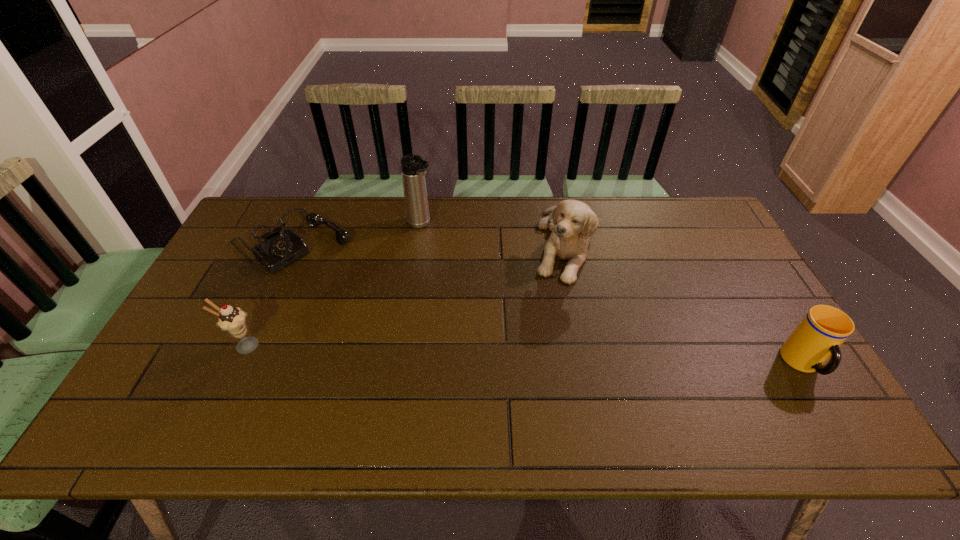
Identify the location of vacant area that lies between the thermos bottle and the icecream. (332, 286).

Identify which object is the second closest to the shortest object. Please provide its 2D coordinates. Your answer should be formatted as a tuple, i.e. [(x, y)], where the tuple contains the x and y coordinates of a point satisfying the conditions above.

[(232, 320)]

Identify which object is the closest to the puppy. Please provide its 2D coordinates. Your answer should be formatted as a tuple, i.e. [(x, y)], where the tuple contains the x and y coordinates of a point satisfying the conditions above.

[(413, 168)]